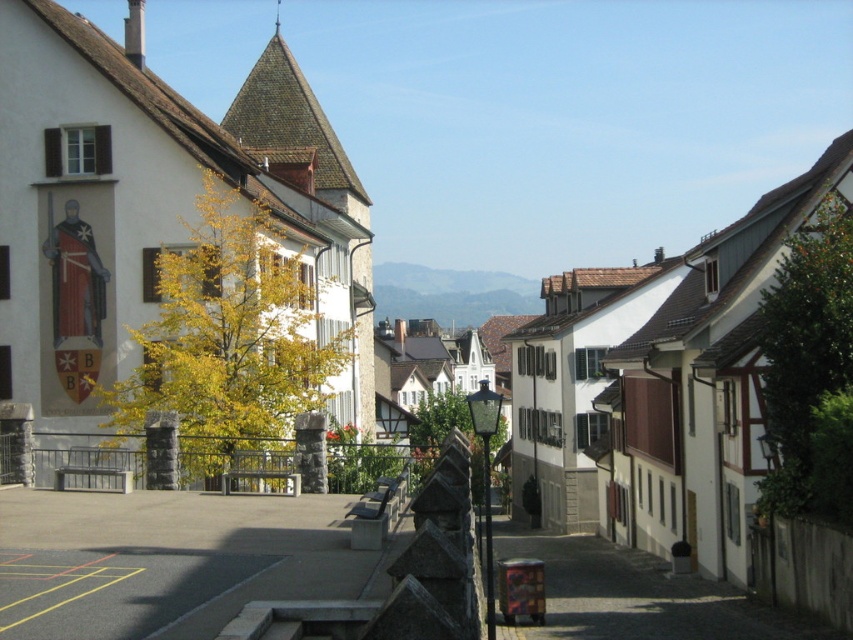
Question: Which of the following is the farthest from the observer?

Choices:
 (A) yellow leafy tree at left
 (B) green leafy tree at right

Answer: (A)

Question: Can you confirm if yellow leafy tree at left is positioned to the right of green leafy tree at right?

Choices:
 (A) yes
 (B) no

Answer: (B)

Question: Is yellow leafy tree at left above green leafy tree at right?

Choices:
 (A) yes
 (B) no

Answer: (B)

Question: Does yellow leafy tree at left have a larger size compared to green leafy tree at right?

Choices:
 (A) yes
 (B) no

Answer: (A)

Question: Which point is closer to the camera taking this photo?

Choices:
 (A) (186, 468)
 (B) (788, 397)

Answer: (B)